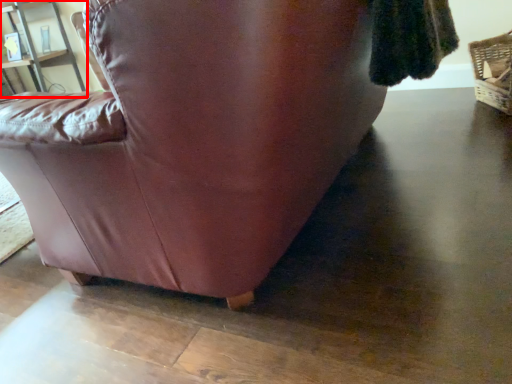
Question: Observing the image, what is the correct spatial positioning of shelf (annotated by the red box) in reference to basket?

Choices:
 (A) left
 (B) right

Answer: (A)